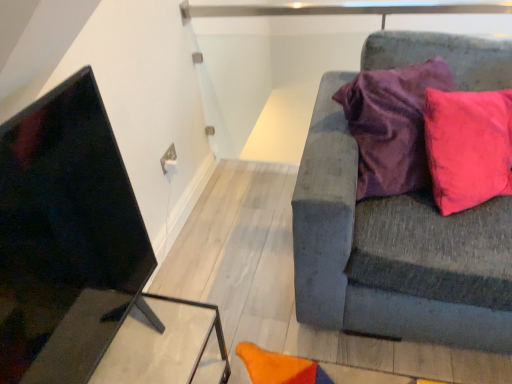
Question: Is matte black table at lower left positioned before textured gray couch at right?

Choices:
 (A) yes
 (B) no

Answer: (B)

Question: Is matte black table at lower left looking in the opposite direction of textured gray couch at right?

Choices:
 (A) no
 (B) yes

Answer: (A)

Question: Is matte black table at lower left to the left of textured gray couch at right from the viewer's perspective?

Choices:
 (A) no
 (B) yes

Answer: (B)

Question: Can textured gray couch at right be found inside matte black table at lower left?

Choices:
 (A) yes
 (B) no

Answer: (B)

Question: From a real-world perspective, is matte black table at lower left beneath textured gray couch at right?

Choices:
 (A) no
 (B) yes

Answer: (B)

Question: Is matte black table at lower left directly adjacent to textured gray couch at right?

Choices:
 (A) yes
 (B) no

Answer: (B)

Question: Is the surface of textured gray couch at right in direct contact with matte black table at lower left?

Choices:
 (A) no
 (B) yes

Answer: (A)

Question: Considering the relative positions of textured gray couch at right and matte black table at lower left in the image provided, is textured gray couch at right in front of matte black table at lower left?

Choices:
 (A) no
 (B) yes

Answer: (B)

Question: Considering the relative positions of textured gray couch at right and matte black table at lower left in the image provided, is textured gray couch at right to the left of matte black table at lower left from the viewer's perspective?

Choices:
 (A) yes
 (B) no

Answer: (B)

Question: Considering the relative sizes of textured gray couch at right and matte black table at lower left in the image provided, is textured gray couch at right smaller than matte black table at lower left?

Choices:
 (A) no
 (B) yes

Answer: (A)

Question: From a real-world perspective, does textured gray couch at right stand above matte black table at lower left?

Choices:
 (A) no
 (B) yes

Answer: (B)

Question: Does textured gray couch at right have a larger size compared to matte black table at lower left?

Choices:
 (A) yes
 (B) no

Answer: (A)

Question: Visually, is textured gray couch at right positioned to the left or to the right of matte black table at lower left?

Choices:
 (A) left
 (B) right

Answer: (B)